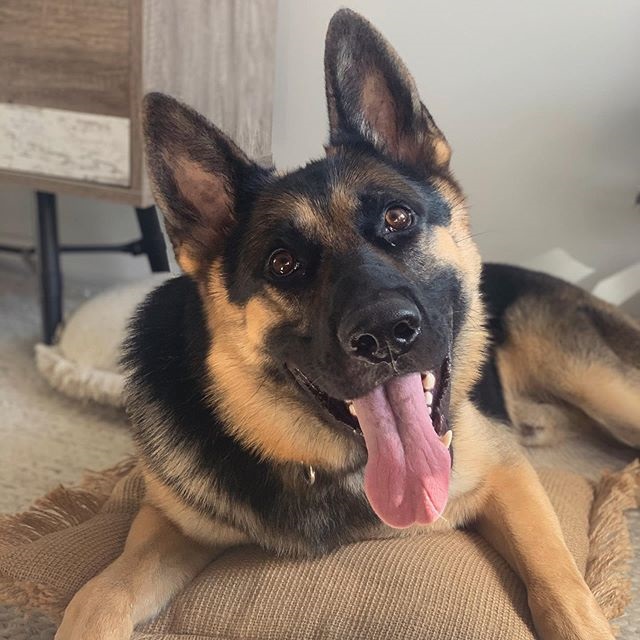
Identify the location of table leg. (54, 241).